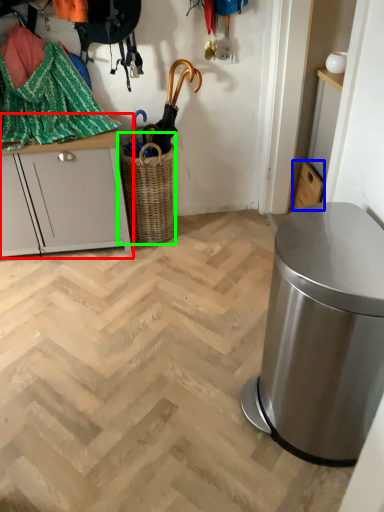
Question: Based on their relative distances, which object is farther from cabinetry (highlighted by a red box)? Choose from cabinetry (highlighted by a blue box) and basket (highlighted by a green box).

Choices:
 (A) cabinetry
 (B) basket

Answer: (A)